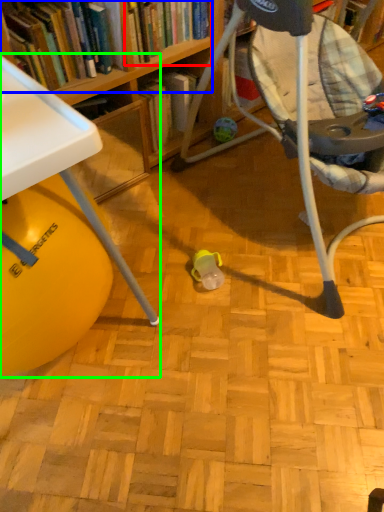
Question: Which object is the closest to the book (highlighted by a red box)? Choose among these: book (highlighted by a blue box) or table (highlighted by a green box).

Choices:
 (A) book
 (B) table

Answer: (A)